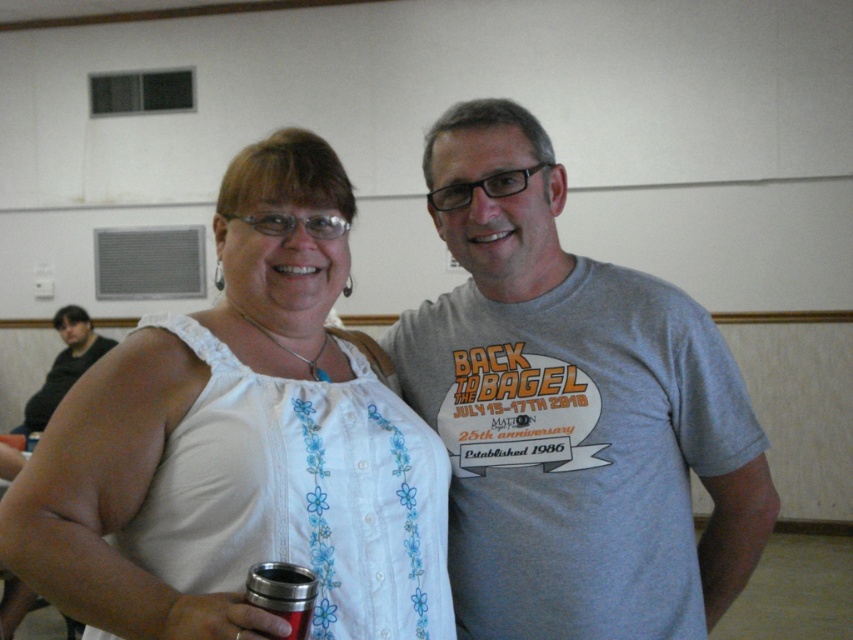
This screenshot has width=853, height=640. What do you see at coordinates (241, 445) in the screenshot?
I see `white embroidered tank top at center` at bounding box center [241, 445].

Who is lower down, white embroidered tank top at center or matte white tank top at center?

matte white tank top at center is below.

Is point (407, 488) more distant than point (102, 346)?

That is False.

What are the coordinates of `white embroidered tank top at center` in the screenshot? It's located at (241, 445).

Does point (442, 156) lie in front of point (283, 570)?

No.

Does gray cotton t-shirt at center appear on the left side of brushed metal cup at lower left?

In fact, gray cotton t-shirt at center is to the right of brushed metal cup at lower left.

Is point (514, 513) positioned in front of point (294, 618)?

No, (514, 513) is behind (294, 618).

Locate an element on the screen. The image size is (853, 640). gray cotton t-shirt at center is located at coordinates (572, 412).

Does gray cotton t-shirt at center appear over matte white tank top at center?

Indeed, gray cotton t-shirt at center is positioned over matte white tank top at center.

Locate an element on the screen. Image resolution: width=853 pixels, height=640 pixels. gray cotton t-shirt at center is located at coordinates (572, 412).

This screenshot has height=640, width=853. What are the coordinates of `gray cotton t-shirt at center` in the screenshot? It's located at (572, 412).